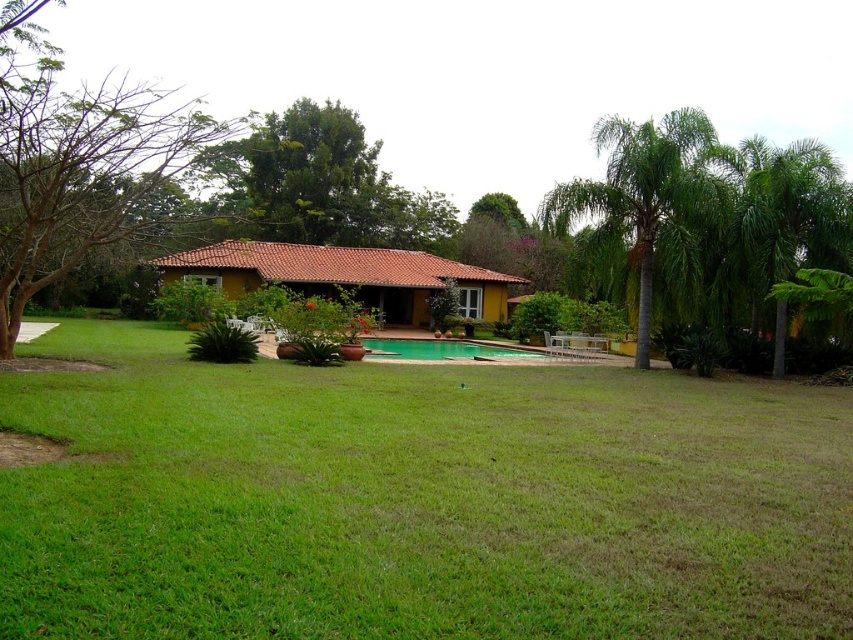
You are planning to install a new fence around the property. Considering the size of the green leafy palm tree at right and the green glossy pool at center, which one would require more space between them to accommodate their sizes?

The green leafy palm tree at right is bigger than the green glossy pool at center, so it would require more space between them to accommodate its larger size.

You are standing in the front yard of the house and want to place a new garden bench. You have two options for placement. One is near the bare branches at left, and the other is near the green glossy pool at center. Which location would be closer to the left side of the pool?

The bare branches at left is positioned on the left side of green glossy pool at center, so placing the bench near the bare branches at left would be closer to the left side of the pool.

You are planning to install a new lighting system for the bare branches at left and the green glossy pool at center. Since the lighting fixtures must be placed at the highest point to cover both areas, which object should you consider as the reference point for the height?

The bare branches at left is much taller than the green glossy pool at center, so you should use the bare branches at left as the reference point for the height to ensure the lighting fixtures can adequately cover both areas.